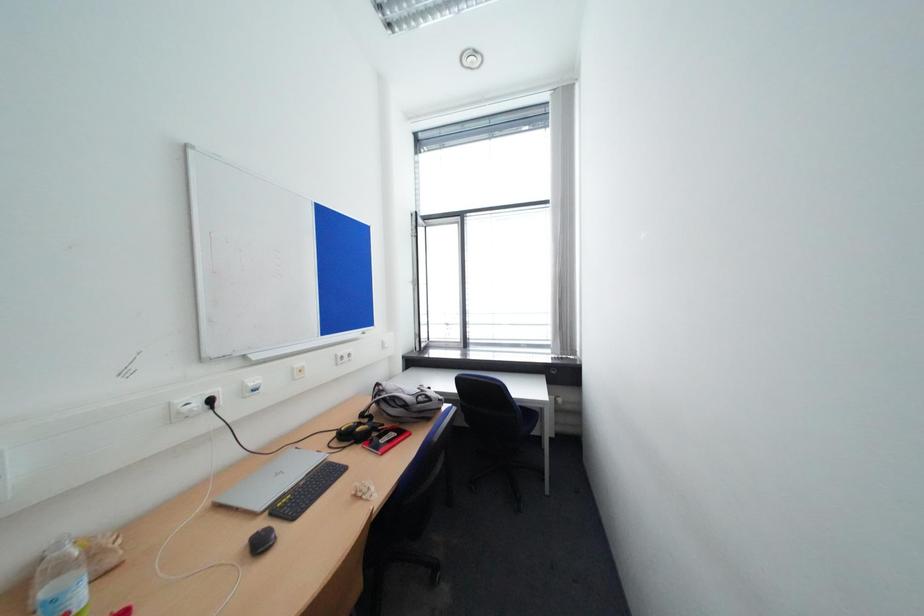
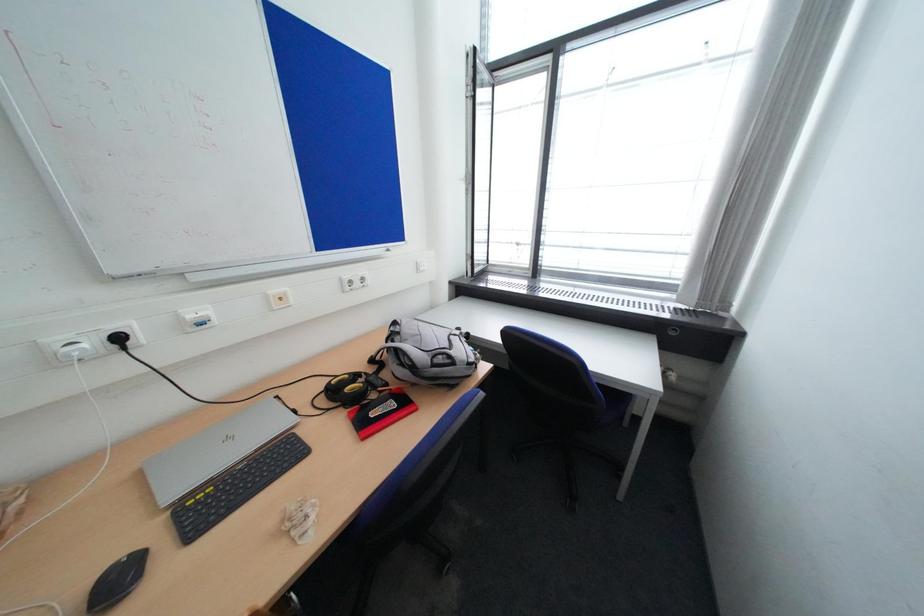
Question: In a continuous first-person perspective shot, in which direction is the camera moving?

Choices:
 (A) Left
 (B) Right
 (C) Forward
 (D) Backward

Answer: (C)